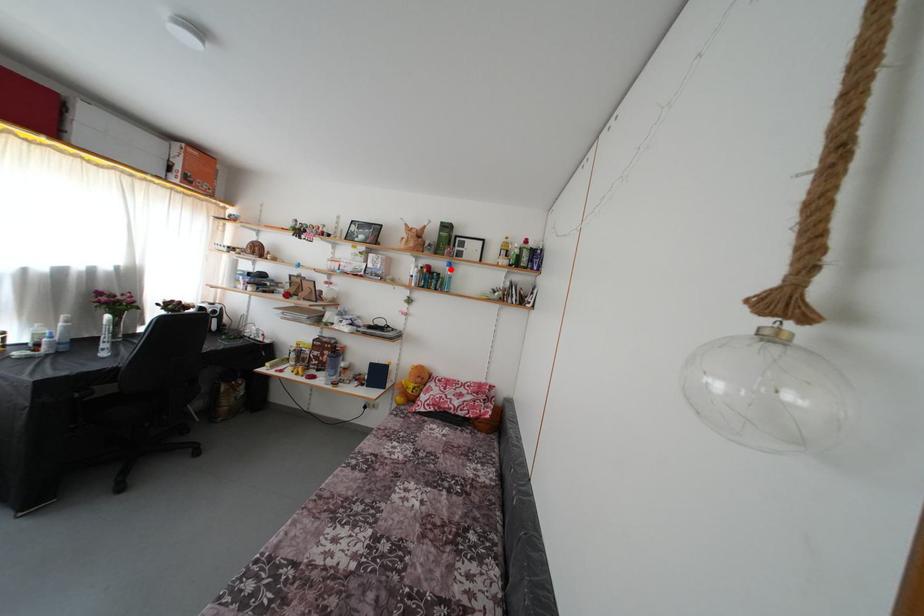
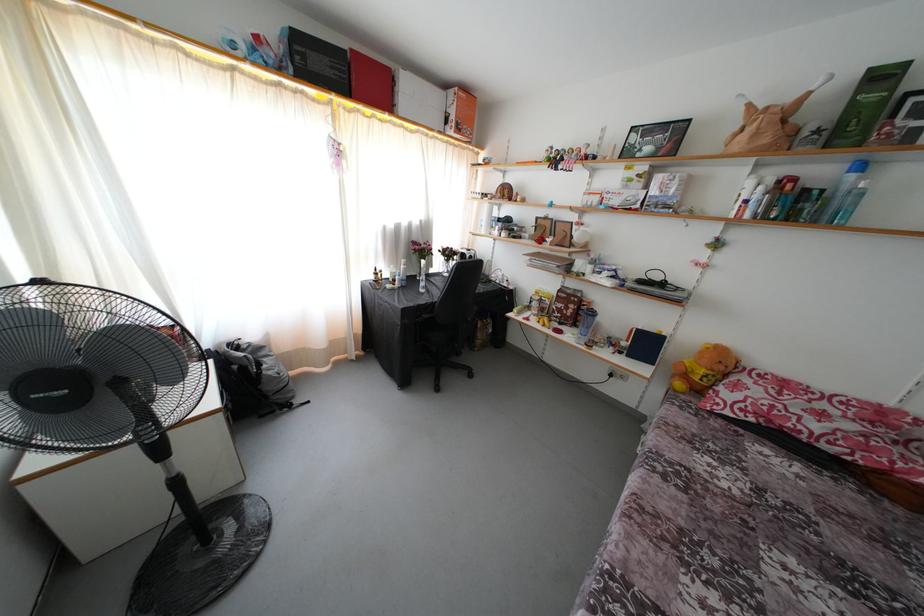
Question: I am providing you with two images of the same scene from different viewpoints. A red point is marked on the first image. At the location where the point appears in image 1, is it still visible in image 2?

Choices:
 (A) Yes
 (B) No

Answer: (A)